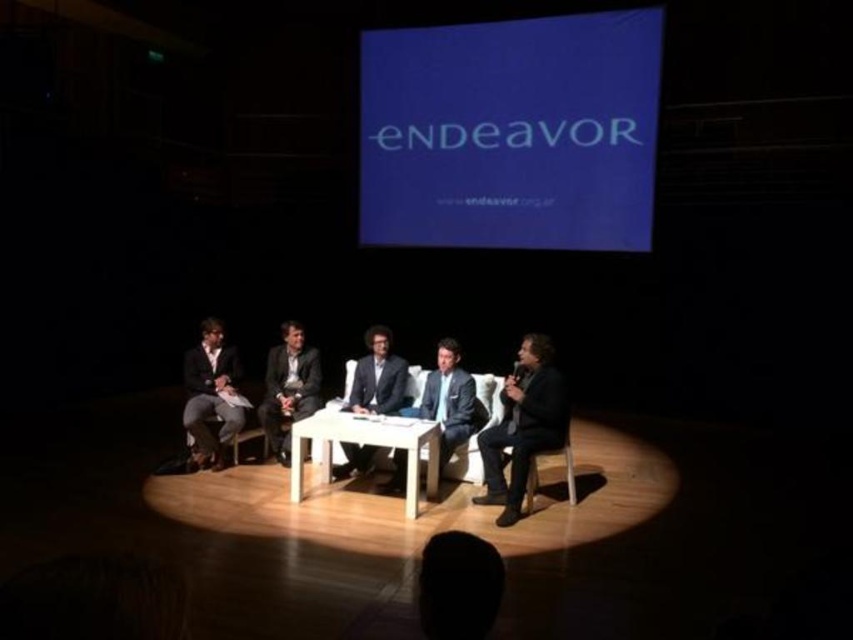
You are a photographer taking a picture of the panel discussion stage. You need to focus on two specific points on the stage, point (537, 404) and point (561, 440). Which point should you adjust your camera focus to first if you want to capture the one closer to the front of the stage?

Point (537, 404) is closer to the viewer than point (561, 440), so you should focus on point (537, 404) first to capture the one closer to the front of the stage.

You are an event photographer positioned behind the stage. You need to capture a photo that includes both the matte black suit at left and the dark gray suit at center. Based on their positions, which one should you adjust your camera angle to focus on first to ensure both are in frame?

The matte black suit at left is to the left of the dark gray suit at center, so you should first focus on the matte black suit at left to ensure both are included in the frame.

You are an event organizer who needs to ensure that all participants have enough space on the stage. Given that the stage has limited space and you see the black leather jacket at center and the light blue suit at center, which participant should you consider moving to make more room?

The black leather jacket at center is bigger than the light blue suit at center, so moving the participant wearing the black leather jacket at center would free up more space.